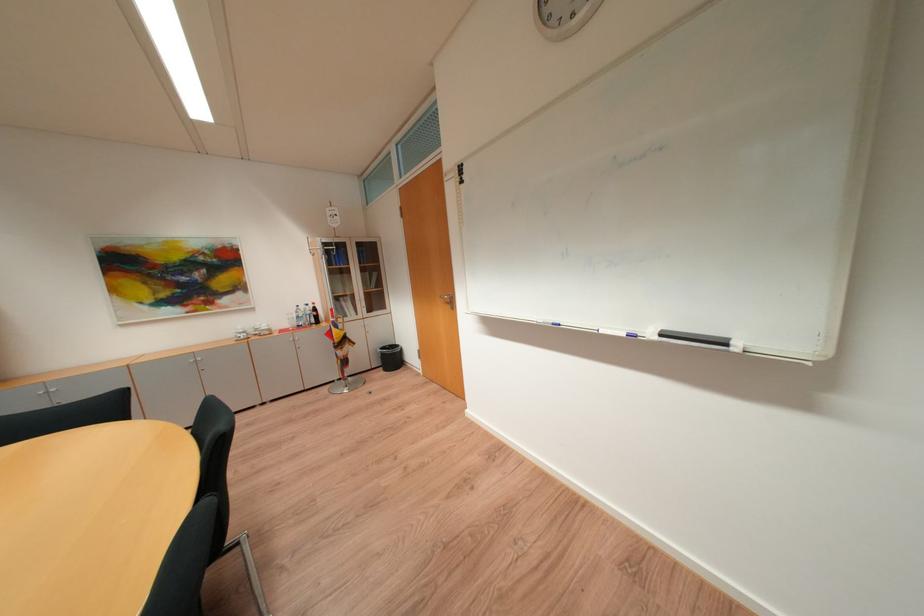
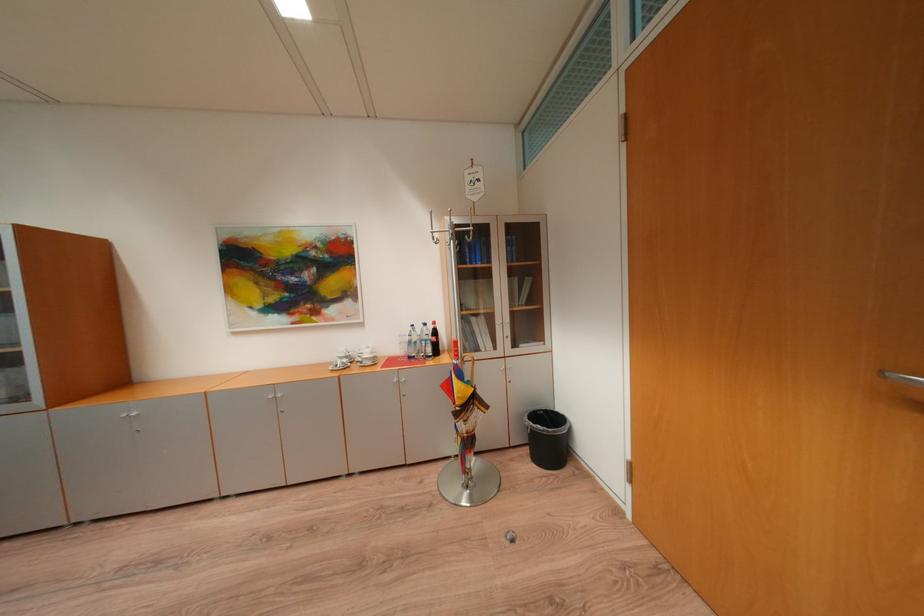
The point at (400, 360) is marked in the first image. Where is the corresponding point in the second image?

(556, 440)